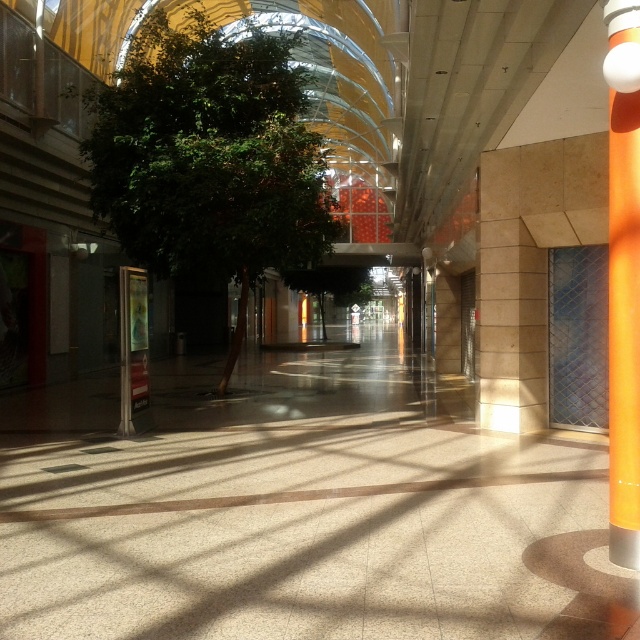
Does green leafy tree at center have a lesser height compared to orange glossy pole at right?

Correct, green leafy tree at center is not as tall as orange glossy pole at right.

Is green leafy tree at center smaller than orange glossy pole at right?

Yes.

Which is in front, point (180, 236) or point (625, 125)?

Point (625, 125) is in front.

This screenshot has height=640, width=640. Identify the location of green leafy tree at center. (209, 157).